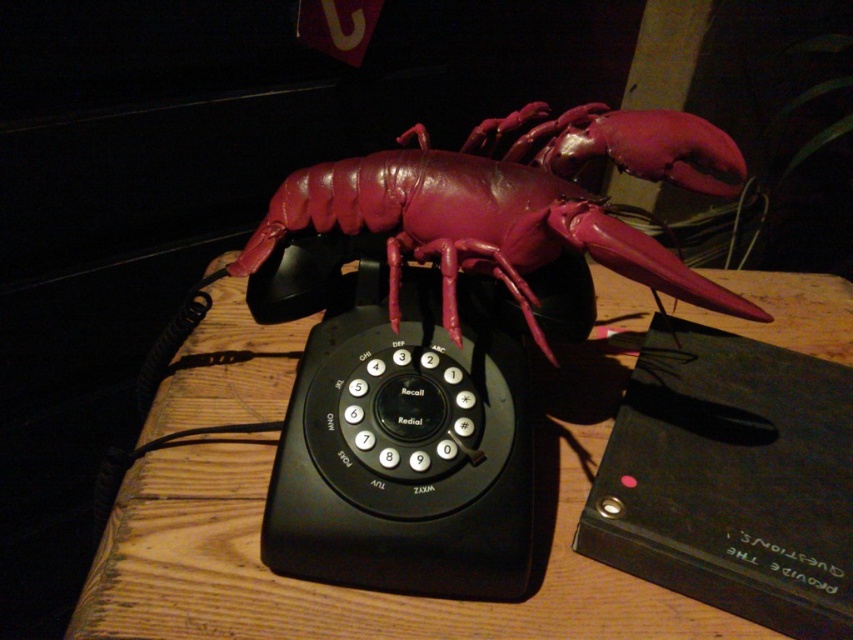
Question: Does black plastic rotary phone at center have a larger size compared to glossy plastic lobster at center?

Choices:
 (A) no
 (B) yes

Answer: (A)

Question: Which object is positioned closest to the wooden table at center?

Choices:
 (A) black plastic rotary phone at center
 (B) glossy plastic lobster at center

Answer: (A)

Question: Among these objects, which one is farthest from the camera?

Choices:
 (A) glossy plastic lobster at center
 (B) black plastic rotary phone at center

Answer: (B)

Question: Can you confirm if black plastic rotary phone at center is positioned to the left of glossy plastic lobster at center?

Choices:
 (A) no
 (B) yes

Answer: (B)

Question: Which of the following is the farthest from the observer?

Choices:
 (A) (99, 612)
 (B) (590, 193)

Answer: (B)

Question: Considering the relative positions of wooden table at center and black plastic rotary phone at center in the image provided, where is wooden table at center located with respect to black plastic rotary phone at center?

Choices:
 (A) left
 (B) right

Answer: (B)